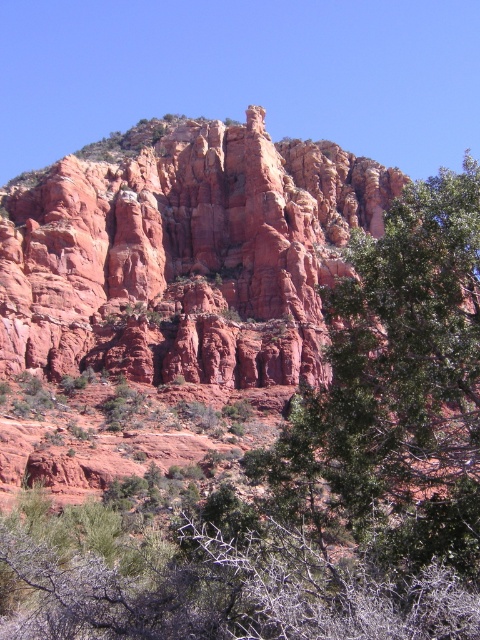
Question: Which point is closer to the camera?

Choices:
 (A) green leafy tree at center
 (B) reddish-brown rock formation at center

Answer: (A)

Question: Among these objects, which one is farthest from the camera?

Choices:
 (A) green leafy tree at center
 (B) reddish-brown rock formation at center

Answer: (B)

Question: Can you confirm if reddish-brown rock formation at center is wider than green leafy tree at center?

Choices:
 (A) no
 (B) yes

Answer: (A)

Question: Observing the image, what is the correct spatial positioning of reddish-brown rock formation at center in reference to green leafy tree at center?

Choices:
 (A) right
 (B) left

Answer: (B)

Question: Does reddish-brown rock formation at center lie in front of green leafy tree at center?

Choices:
 (A) no
 (B) yes

Answer: (A)